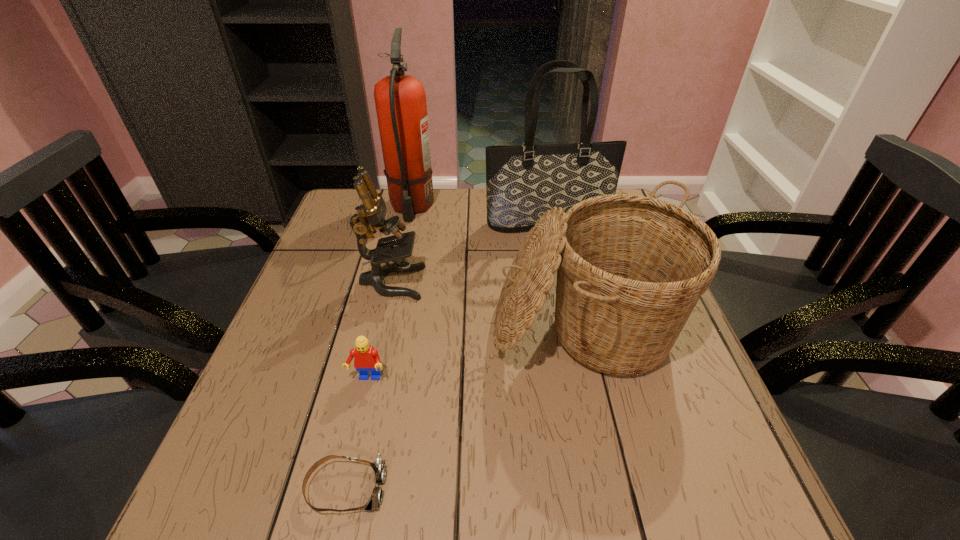
The height and width of the screenshot is (540, 960). I want to click on fire extinguisher, so click(400, 100).

Where is `tote bag`? This screenshot has width=960, height=540. tote bag is located at coordinates (523, 181).

Locate an element on the screen. microscope is located at coordinates (371, 214).

The image size is (960, 540). I want to click on basket, so click(630, 269).

Identify the location of the fifth tallest object. pyautogui.click(x=366, y=358).

What are the coordinates of `the shortest object` in the screenshot? It's located at (375, 500).

I want to click on goggles, so click(x=375, y=500).

Identify the location of blank area located 0.260m on the nozzle of the fire extinguisher. (394, 289).

Locate an element on the screen. blank area located on the front of the tote bag is located at coordinates coord(567,316).

Locate an element on the screen. free point located 0.250m at the eyepieces of the microscope is located at coordinates (523, 282).